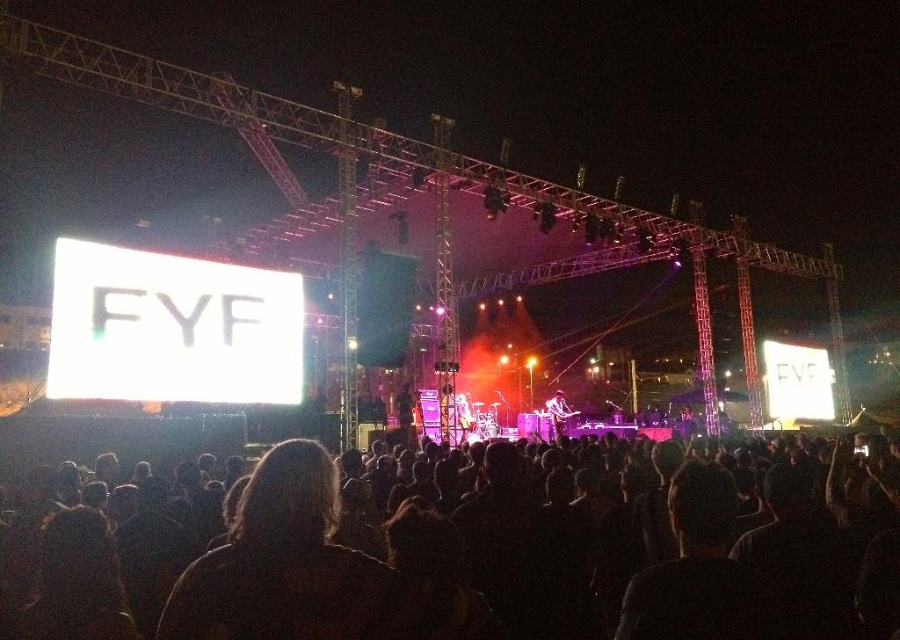
Is black matte crowd at center positioned at the back of dark hair at center?

Yes, it is.

Who is taller, black matte crowd at center or dark hair at center?

Standing taller between the two is black matte crowd at center.

Is point (858, 588) less distant than point (313, 536)?

No, it is behind (313, 536).

This screenshot has width=900, height=640. Find the location of `black matte crowd at center`. black matte crowd at center is located at coordinates (484, 554).

Is point (403, 429) farther from viewer compared to point (561, 417)?

No, it is not.

Which is more to the right, black fabric at center or shiny silver guitar at center?

shiny silver guitar at center is more to the right.

At what (x,y) coordinates should I click in order to perform the action: click on black fabric at center. Please return your answer as a coordinate pair (x, y). The width and height of the screenshot is (900, 640). Looking at the image, I should click on (405, 413).

Does black matte crowd at center appear under black fabric at center?

Yes, black matte crowd at center is below black fabric at center.

Who is more distant from viewer, (x=246, y=541) or (x=412, y=412)?

The point (x=412, y=412) is more distant.

Where is `black matte crowd at center`? This screenshot has width=900, height=640. black matte crowd at center is located at coordinates (484, 554).